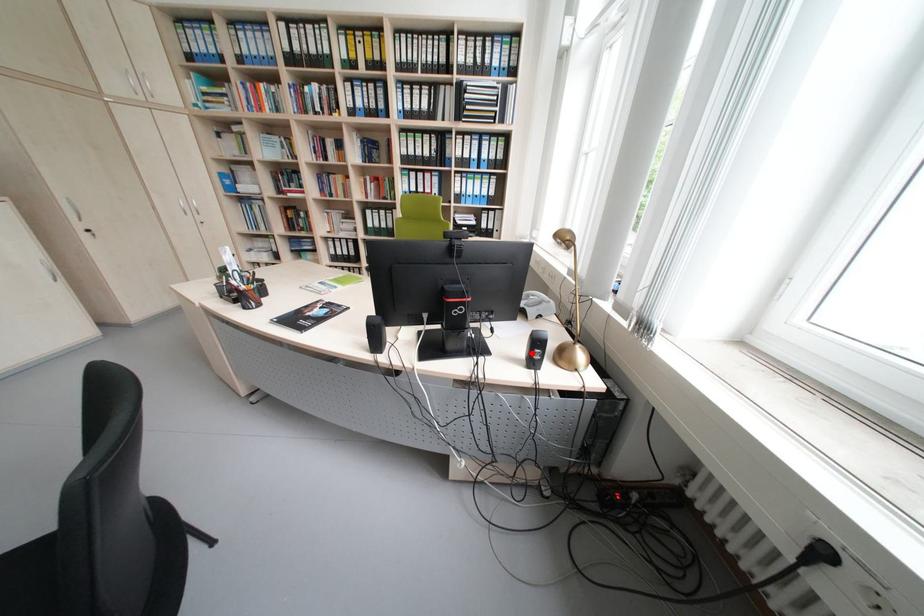
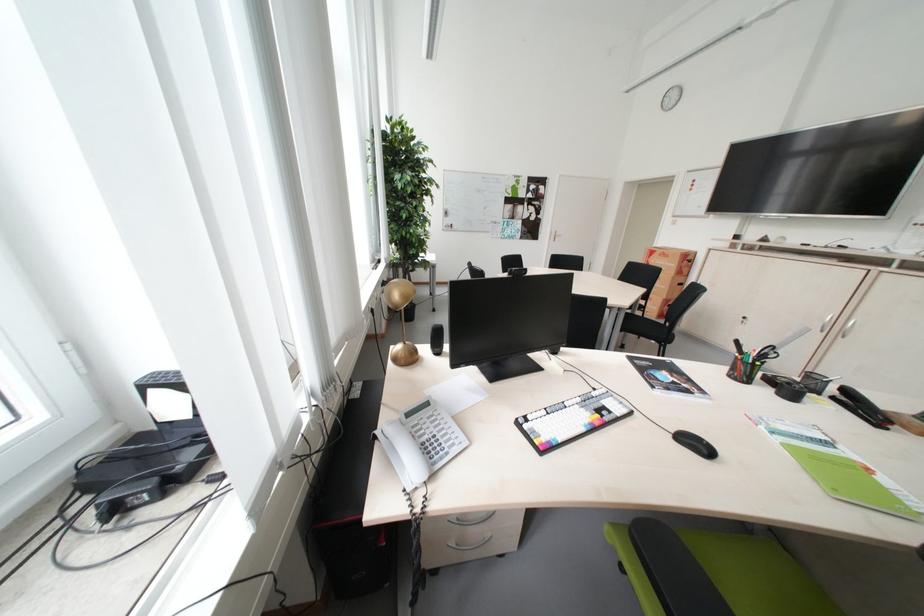
Question: I am providing you with two images of the same scene from different viewpoints. A red point is marked on the first image. Can you still see the location of the red point in image 2?

Choices:
 (A) Yes
 (B) No

Answer: (B)